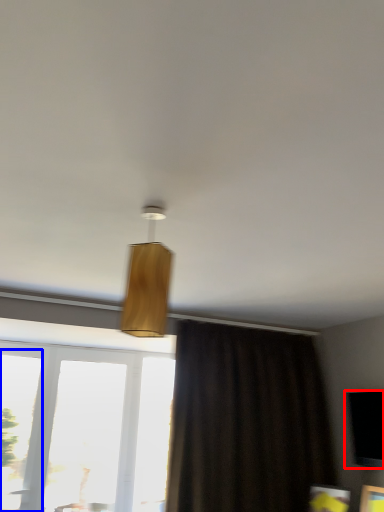
Question: Which object is closer to the camera taking this photo, window screen (highlighted by a red box) or window (highlighted by a blue box)?

Choices:
 (A) window screen
 (B) window

Answer: (A)